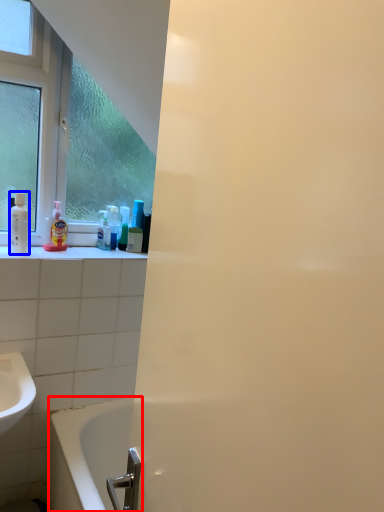
Question: Which of the following is the closest to the observer, bathtub (highlighted by a red box) or mouthwash (highlighted by a blue box)?

Choices:
 (A) bathtub
 (B) mouthwash

Answer: (A)